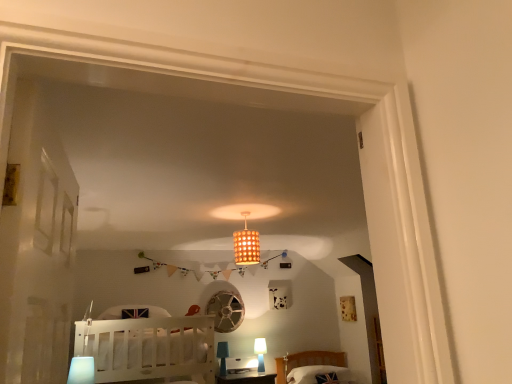
Question: Can you confirm if white wood crib at lower left is smaller than white fabric pillow at lower right?

Choices:
 (A) yes
 (B) no

Answer: (B)

Question: Considering the relative positions of white wood crib at lower left and white fabric pillow at lower right in the image provided, is white wood crib at lower left to the left of white fabric pillow at lower right from the viewer's perspective?

Choices:
 (A) yes
 (B) no

Answer: (A)

Question: Can you confirm if white wood crib at lower left is thinner than white fabric pillow at lower right?

Choices:
 (A) yes
 (B) no

Answer: (B)

Question: Would you say white wood crib at lower left is a long distance from white fabric pillow at lower right?

Choices:
 (A) no
 (B) yes

Answer: (B)

Question: Is white fabric pillow at lower right surrounded by white wood crib at lower left?

Choices:
 (A) no
 (B) yes

Answer: (A)

Question: Based on their sizes in the image, would you say matte white lamp at lower center, placed as the 4th lamp when sorted from front to back, is bigger or smaller than white fabric pillow at lower right?

Choices:
 (A) big
 (B) small

Answer: (B)

Question: Which is correct: matte white lamp at lower center, the fourth lamp viewed from the top, is inside white fabric pillow at lower right, or outside of it?

Choices:
 (A) inside
 (B) outside

Answer: (B)

Question: From the image's perspective, is matte white lamp at lower center, placed as the 4th lamp when sorted from front to back, located above or below white fabric pillow at lower right?

Choices:
 (A) above
 (B) below

Answer: (A)

Question: Is matte white lamp at lower center, marked as the fourth lamp in a left-to-right arrangement, to the left or to the right of white fabric pillow at lower right in the image?

Choices:
 (A) right
 (B) left

Answer: (B)

Question: Is matte white lamp at lower center, arranged as the 1th lamp when ordered from the bottom, to the left or to the right of wooden textured lampshade at center, which appears as the second lamp when viewed from the right, in the image?

Choices:
 (A) right
 (B) left

Answer: (A)

Question: Considering the positions of matte white lamp at lower center, marked as the fourth lamp in a left-to-right arrangement, and wooden textured lampshade at center, which appears as the second lamp when viewed from the right, in the image, is matte white lamp at lower center, marked as the fourth lamp in a left-to-right arrangement, bigger or smaller than wooden textured lampshade at center, which appears as the second lamp when viewed from the right,?

Choices:
 (A) big
 (B) small

Answer: (B)

Question: Is matte white lamp at lower center, placed as the 1th lamp when sorted from back to front, wider or thinner than wooden textured lampshade at center, which is the first lamp in top-to-bottom order?

Choices:
 (A) wide
 (B) thin

Answer: (B)

Question: Is matte white lamp at lower center, marked as the fourth lamp in a left-to-right arrangement, taller or shorter than wooden textured lampshade at center, arranged as the fourth lamp when ordered from the bottom?

Choices:
 (A) tall
 (B) short

Answer: (B)

Question: From the image's perspective, relative to matte white lamp at lower center, the first lamp in the right-to-left sequence, is wooden textured lampshade at center, arranged as the fourth lamp when ordered from the bottom, above or below?

Choices:
 (A) above
 (B) below

Answer: (A)

Question: In the image, is wooden textured lampshade at center, which is the first lamp in top-to-bottom order, positioned in front of or behind matte white lamp at lower center, placed as the 1th lamp when sorted from back to front?

Choices:
 (A) front
 (B) behind

Answer: (A)